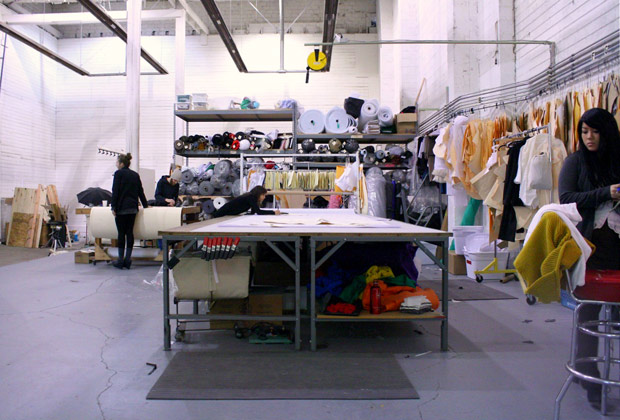
Locate an element on the screen. orange fabric under table is located at coordinates (388, 304).